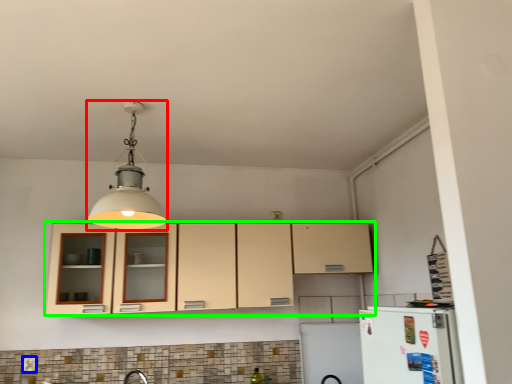
Question: Based on their relative distances, which object is nearer to light fixture (highlighted by a red box)? Choose from electric outlet (highlighted by a blue box) and cabinetry (highlighted by a green box).

Choices:
 (A) electric outlet
 (B) cabinetry

Answer: (B)